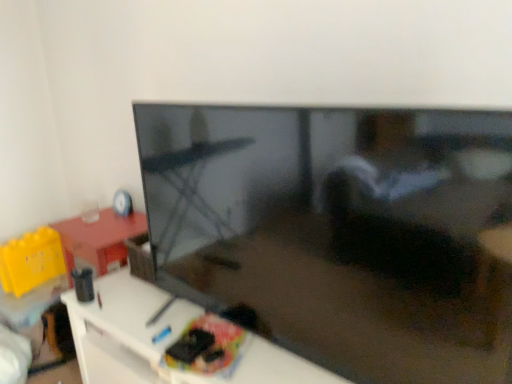
At what (x,y) coordinates should I click in order to perform the action: click on free space in front of matte plastic cd at upper left. Please return your answer as a coordinate pair (x, y). The image size is (512, 384). Looking at the image, I should click on (106, 225).